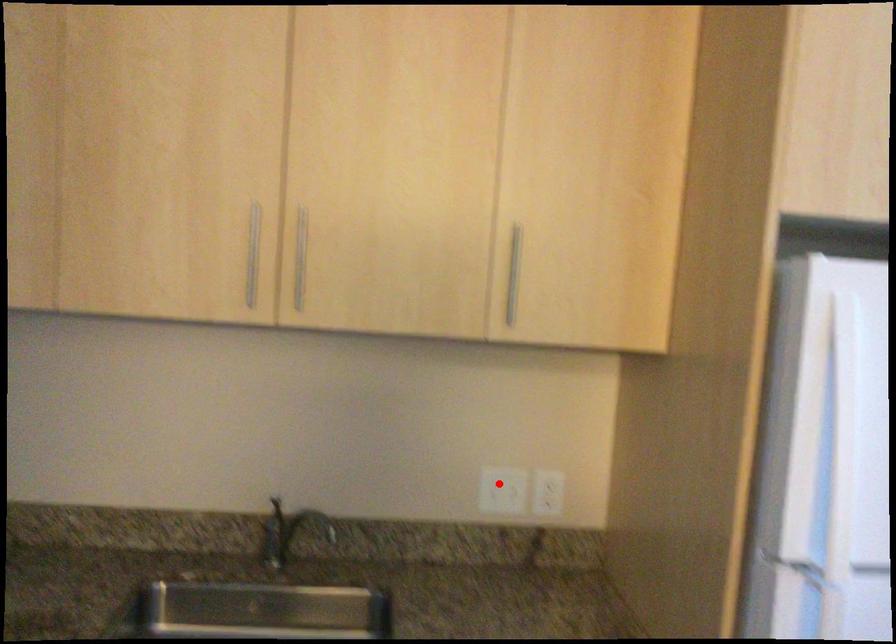
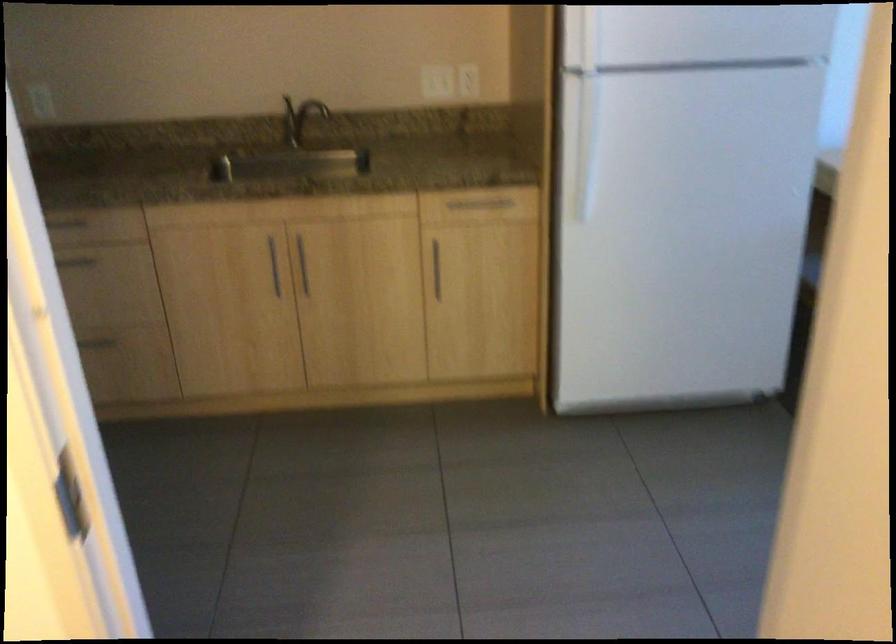
Locate, in the second image, the point that corresponds to the highlighted location in the first image.

(433, 80)